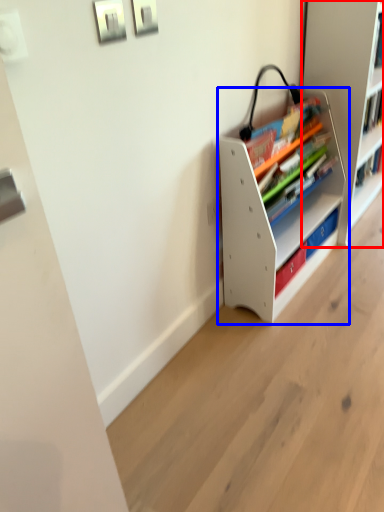
Question: Which object appears farthest to the camera in this image, shelf (highlighted by a red box) or shelf (highlighted by a blue box)?

Choices:
 (A) shelf
 (B) shelf

Answer: (A)